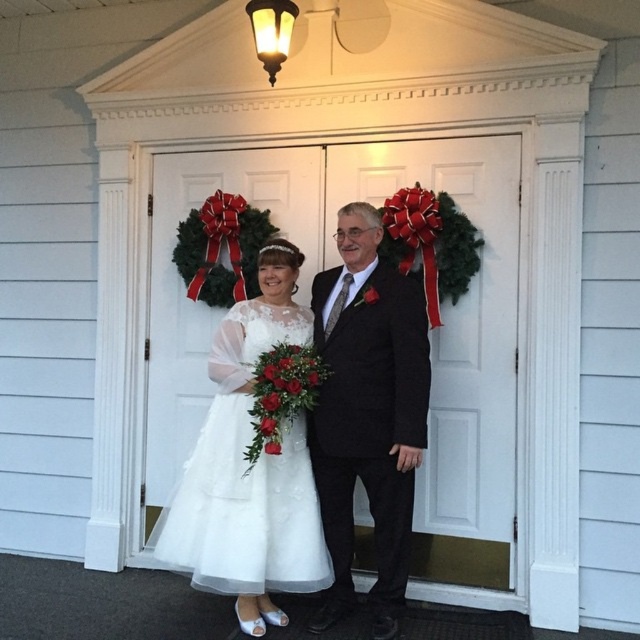
You are a photographer positioned at the camera. You want to capture a closeup shot of the white lace dress at center. Given that your camera can focus on objects within 5 feet, will you need to move closer or farther away?

The white lace dress at center is 9.40 feet from the camera, which is beyond the 5 feet focus range. Therefore, you need to move closer to the white lace dress at center to capture the closeup shot.

Consider the image. You are a photographer taking a picture of the wedding scene. You need to focus on two specific points in the image. The first point is point (477, 333) and the second is point (364, 348). Which point is closer to you?

Point (477, 333) is closer to you than point (364, 348) because it is further to the viewer.

You are a photographer at the wedding and need to capture a full body shot of the bride in her white lace dress at center. The white matte door at center is behind her. Will the door be taller than the bride?

The white matte door at center is taller than white lace dress at center, so yes, the door will be taller than the bride.